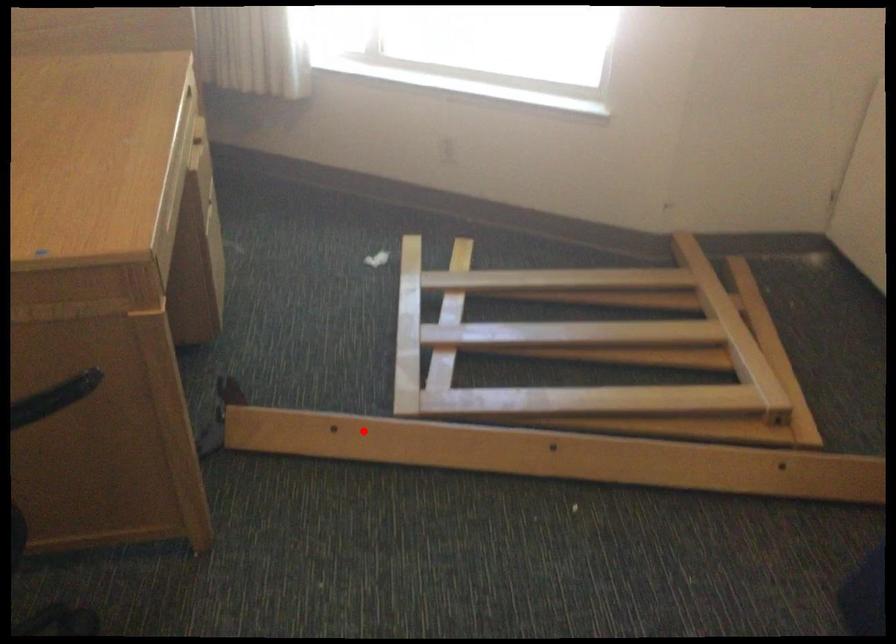
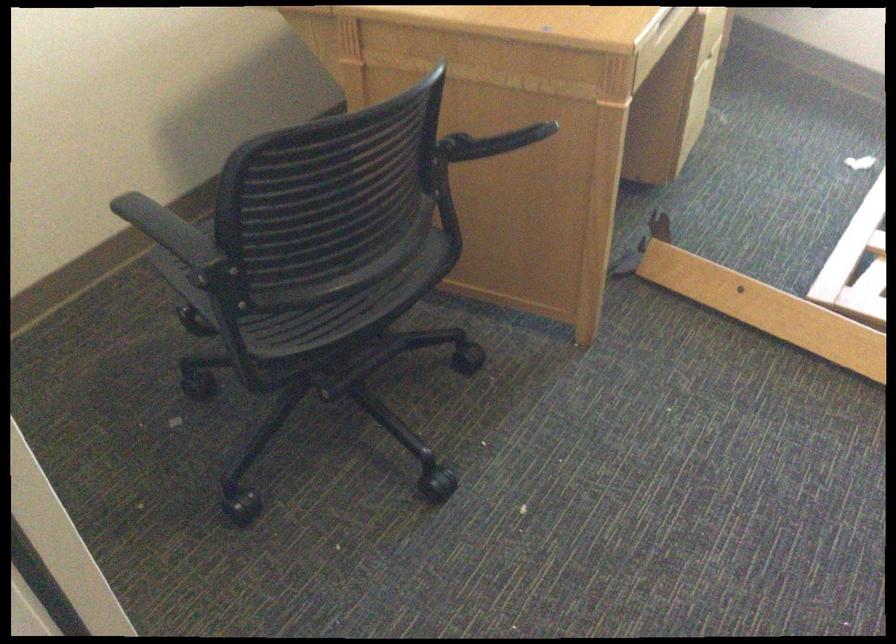
The point at the highlighted location is marked in the first image. Where is the corresponding point in the second image?

(767, 308)